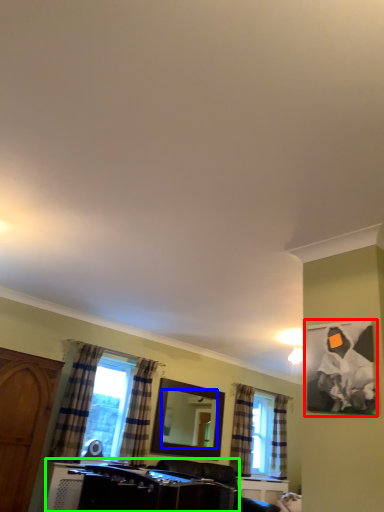
Question: Based on their relative distances, which object is nearer to picture frame (highlighted by a red box)? Choose from mirror (highlighted by a blue box) and vanity (highlighted by a green box).

Choices:
 (A) mirror
 (B) vanity

Answer: (B)